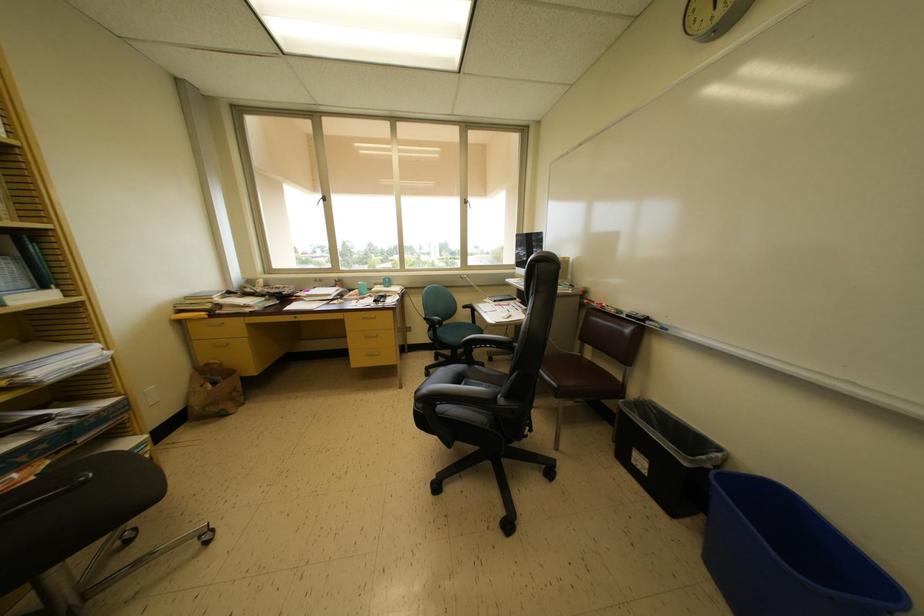
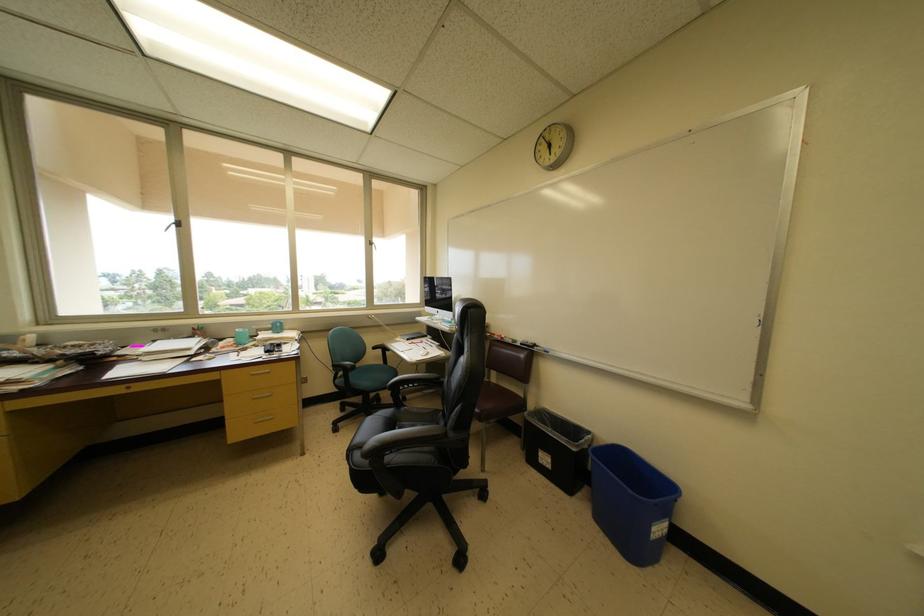
Locate, in the second image, the point that corresponds to point (326, 201) in the first image.

(179, 225)